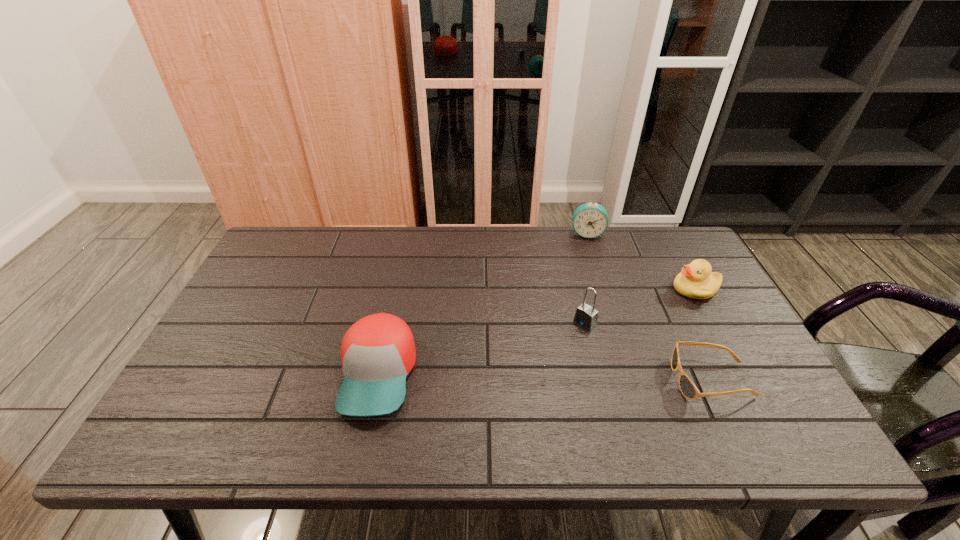
Identify the location of baseball cap. The height and width of the screenshot is (540, 960). (378, 352).

Find the location of `the shortest object`. the shortest object is located at coordinates (688, 389).

The width and height of the screenshot is (960, 540). Find the location of `padlock`. padlock is located at coordinates point(586,316).

Where is `duckling`? The width and height of the screenshot is (960, 540). duckling is located at coordinates (696, 281).

Where is `alarm clock`? The width and height of the screenshot is (960, 540). alarm clock is located at coordinates (589, 220).

Where is `vacant space located on the front-facing side of the sunglasses`? The height and width of the screenshot is (540, 960). vacant space located on the front-facing side of the sunglasses is located at coordinates (570, 380).

Where is `vacant space located on the front-facing side of the sunglasses`? Image resolution: width=960 pixels, height=540 pixels. vacant space located on the front-facing side of the sunglasses is located at coordinates (512, 380).

Find the location of a particular element. This screenshot has width=960, height=540. free space located 0.170m on the front-facing side of the sunglasses is located at coordinates (604, 380).

Locate an element on the screen. The height and width of the screenshot is (540, 960). vacant space located on the shackle of the padlock is located at coordinates 566,339.

Find the location of a particular element. free region located on the shackle of the padlock is located at coordinates (547, 355).